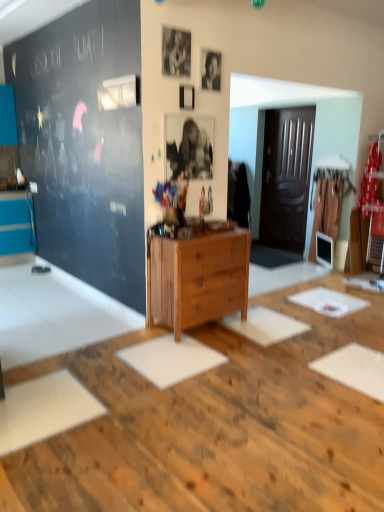
Question: Considering the positions of point (x=367, y=336) and point (x=221, y=267), is point (x=367, y=336) closer or farther from the camera than point (x=221, y=267)?

Choices:
 (A) closer
 (B) farther

Answer: (A)

Question: From the image's perspective, is white matte table at center above or below wooden chest of drawers at center?

Choices:
 (A) below
 (B) above

Answer: (A)

Question: From a real-world perspective, is white matte table at center above or below wooden chest of drawers at center?

Choices:
 (A) below
 (B) above

Answer: (A)

Question: Is wooden chest of drawers at center inside or outside of white matte table at center?

Choices:
 (A) inside
 (B) outside

Answer: (B)

Question: From a real-world perspective, is wooden chest of drawers at center above or below white matte table at center?

Choices:
 (A) below
 (B) above

Answer: (B)

Question: From the image's perspective, relative to white matte table at center, is wooden chest of drawers at center above or below?

Choices:
 (A) above
 (B) below

Answer: (A)

Question: From their relative heights in the image, would you say wooden chest of drawers at center is taller or shorter than white matte table at center?

Choices:
 (A) short
 (B) tall

Answer: (B)